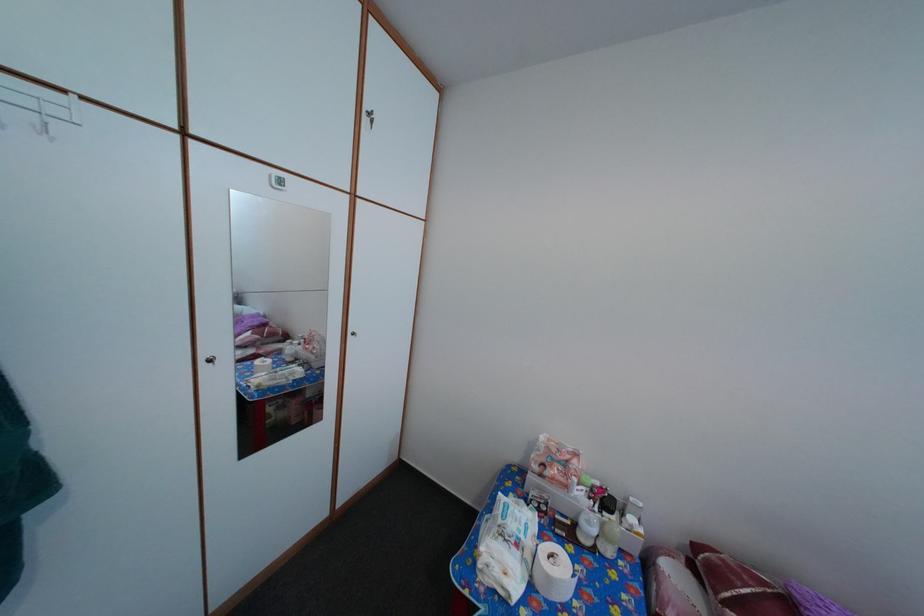
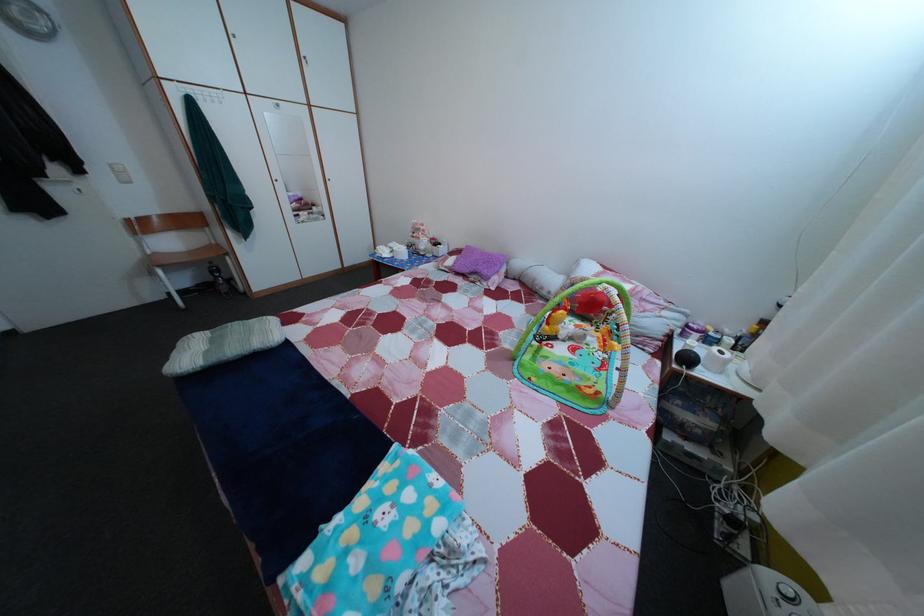
The images are taken continuously from a first-person perspective. In which direction are you moving?

The movement direction of the cameraman is right, backward.